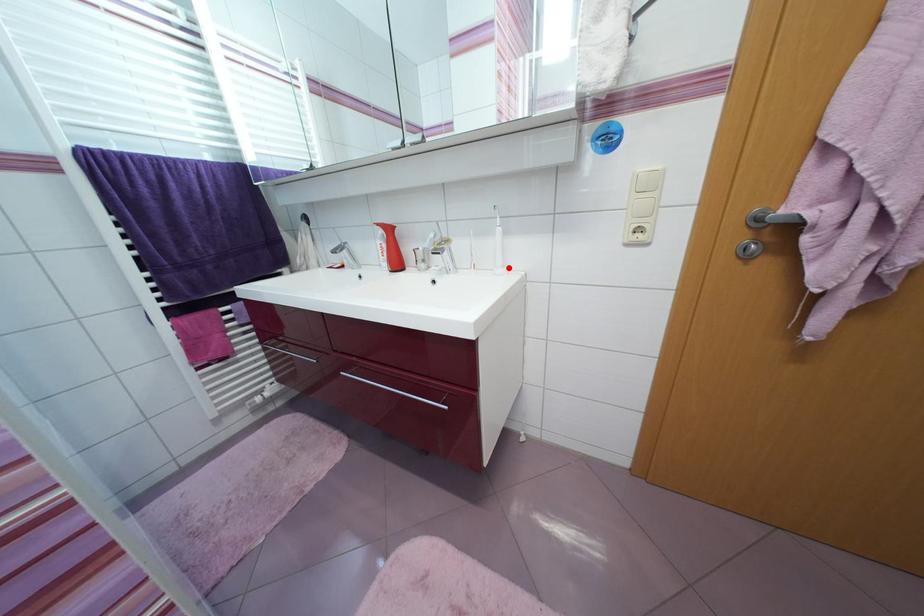
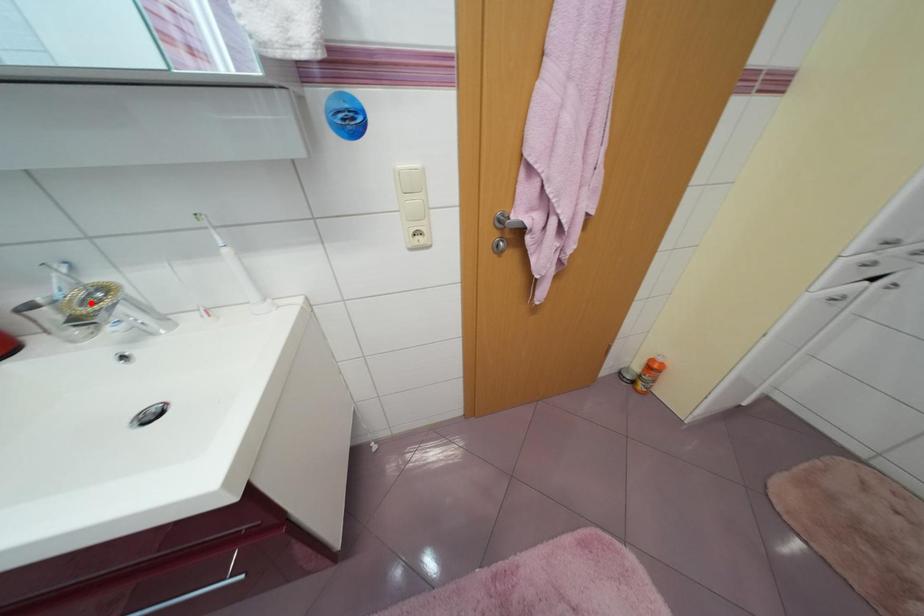
I am providing you with two images of the same scene from different viewpoints. A red point is marked on the first image and another point is marked on the second image. Is the red point in image1 aligned with the point shown in image2?

No